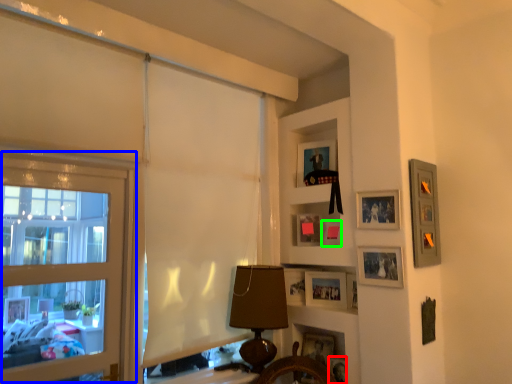
Question: Estimate the real-world distances between objects in this image. Which object is closer to picture frame (highlighted by a red box), window (highlighted by a blue box) or picture frame (highlighted by a green box)?

Choices:
 (A) window
 (B) picture frame

Answer: (B)